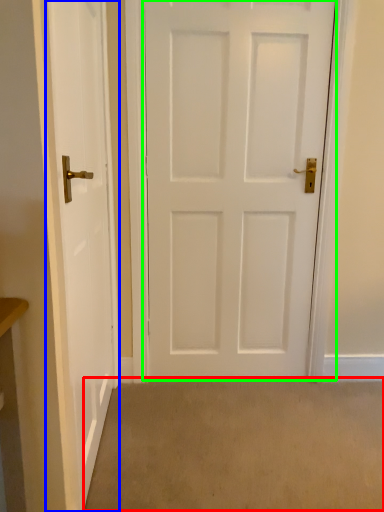
Question: Which is farther away from plain (highlighted by a red box)? door (highlighted by a blue box) or door (highlighted by a green box)?

Choices:
 (A) door
 (B) door

Answer: (B)